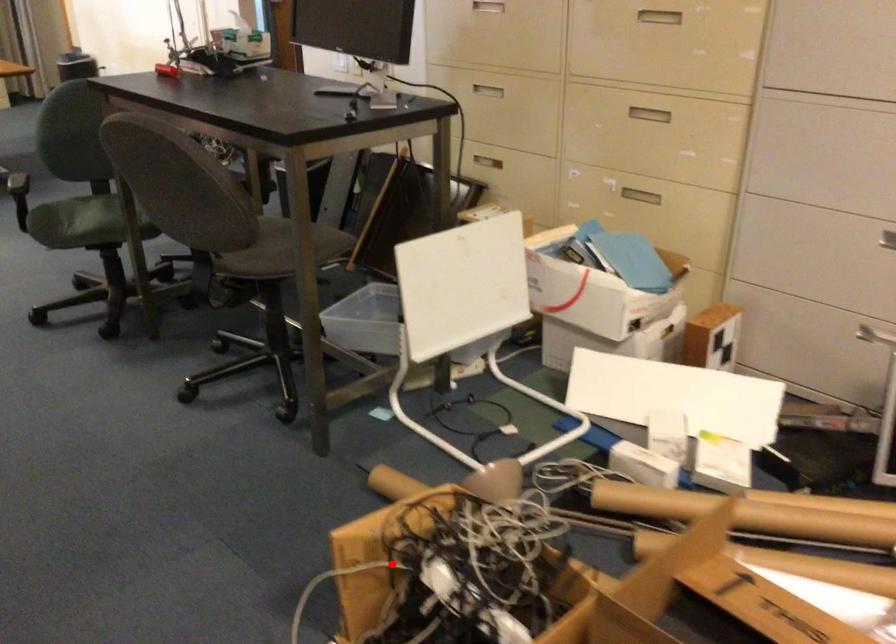
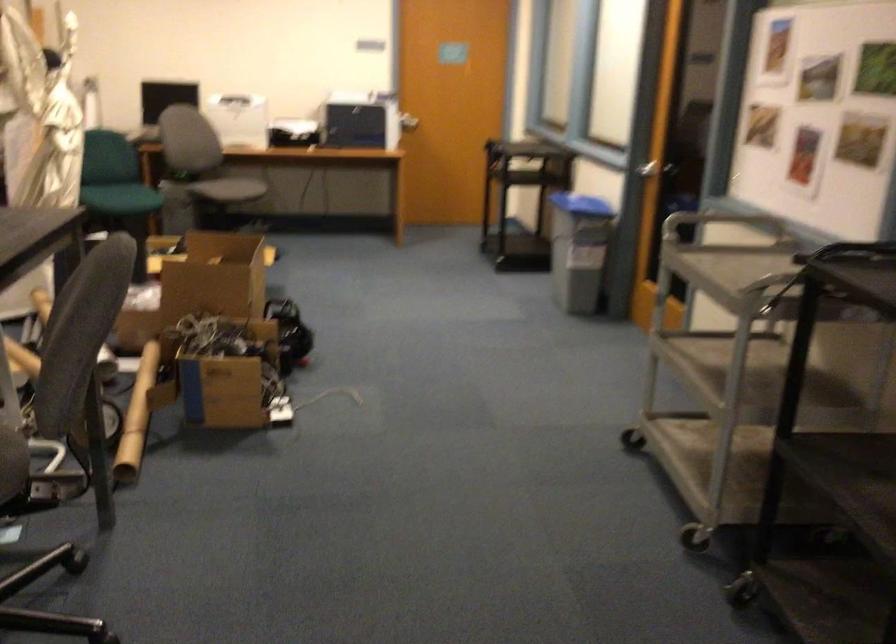
Locate, in the second image, the point that corresponds to the highlighted location in the first image.

(227, 390)